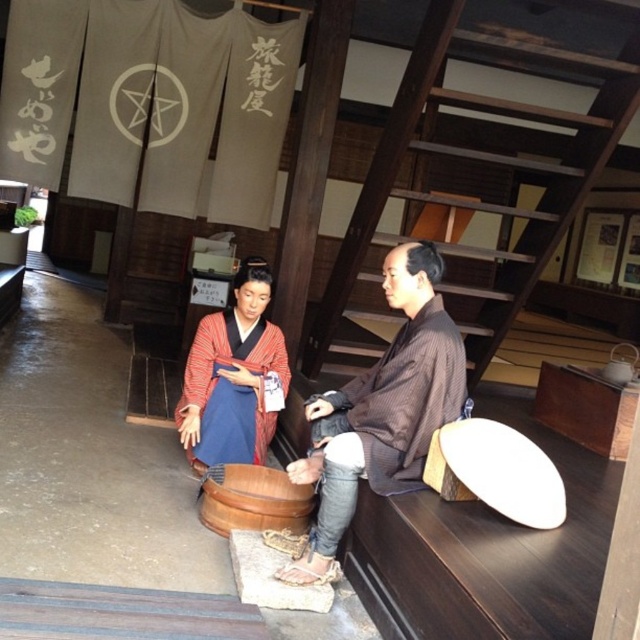
Question: Does brown striped kimono at center lie behind matte red kimono at center?

Choices:
 (A) yes
 (B) no

Answer: (B)

Question: Can you confirm if brown striped kimono at center is wider than matte red kimono at center?

Choices:
 (A) no
 (B) yes

Answer: (B)

Question: Among these points, which one is farthest from the camera?

Choices:
 (A) (189, 401)
 (B) (385, 417)

Answer: (A)

Question: Does brown striped kimono at center appear on the left side of matte red kimono at center?

Choices:
 (A) no
 (B) yes

Answer: (A)

Question: Which object appears farthest from the camera in this image?

Choices:
 (A) matte red kimono at center
 (B) brown striped kimono at center

Answer: (A)